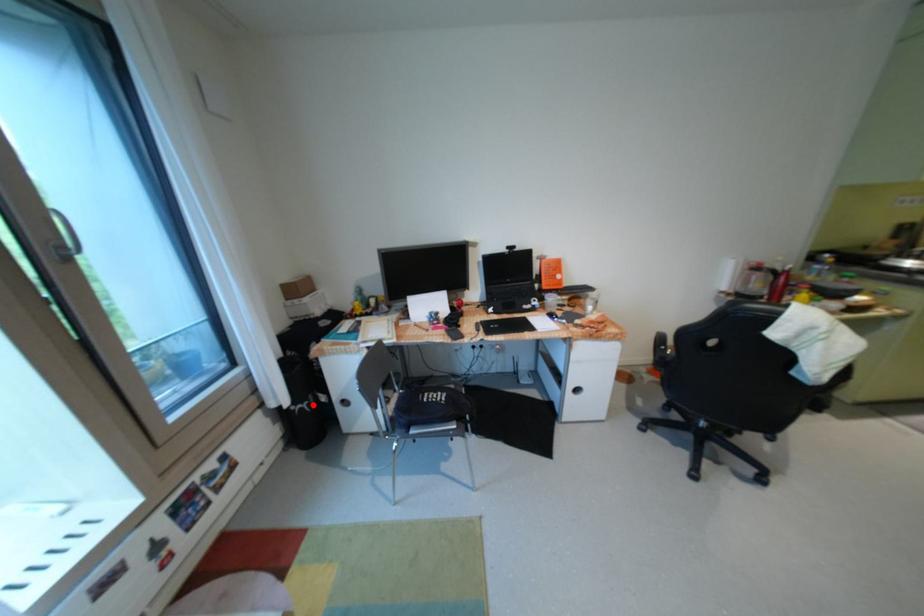
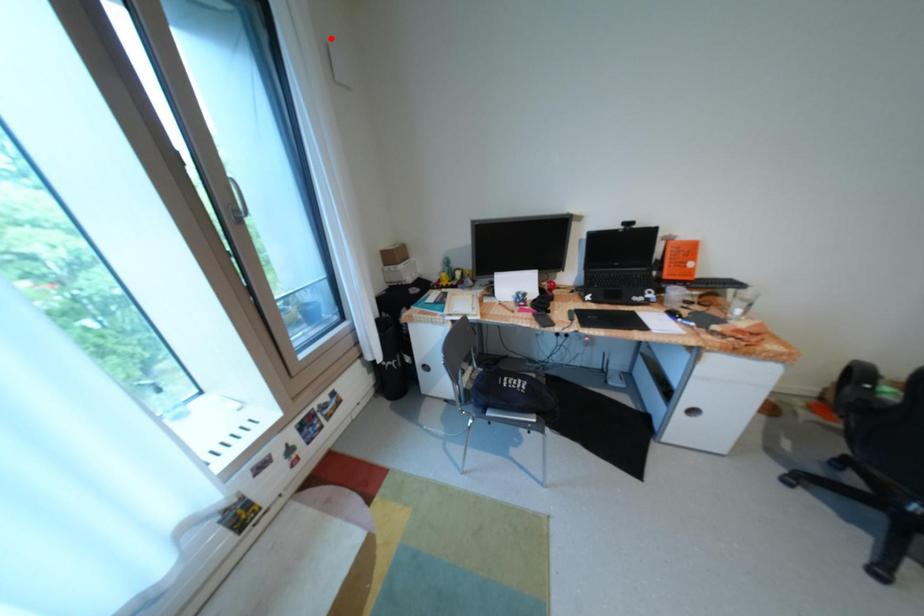
I am providing you with two images of the same scene from different viewpoints. A red point is marked on the first image and another point is marked on the second image. Does the point marked in image1 correspond to the same location as the one in image2?

No